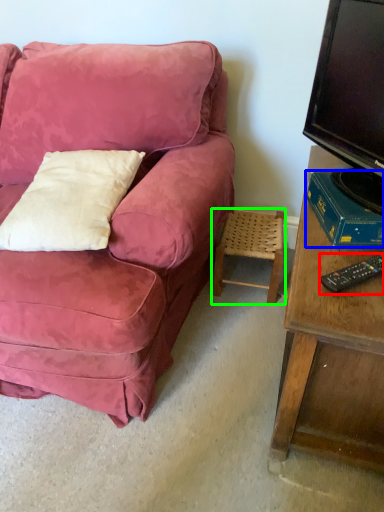
Question: Based on their relative distances, which object is nearer to remote control (highlighted by a red box)? Choose from book (highlighted by a blue box) and stool (highlighted by a green box).

Choices:
 (A) book
 (B) stool

Answer: (A)